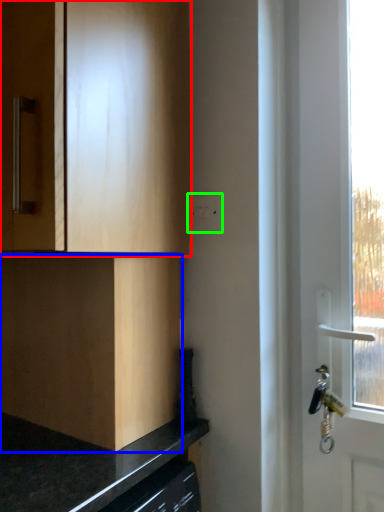
Question: Which object is the closest to the cabinetry (highlighted by a red box)? Choose among these: cabinetry (highlighted by a blue box) or electric outlet (highlighted by a green box).

Choices:
 (A) cabinetry
 (B) electric outlet

Answer: (A)